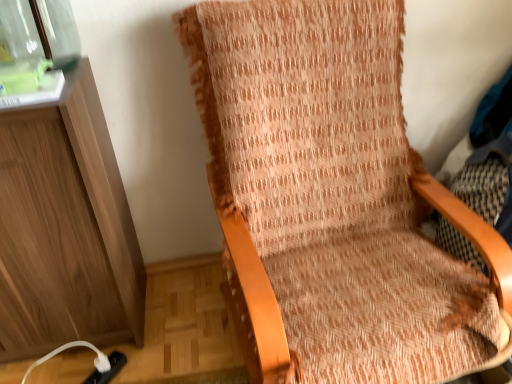
Question: Is transparent glass jar at upper left inside the boundaries of textured orange fabric chair at center, or outside?

Choices:
 (A) inside
 (B) outside

Answer: (B)

Question: From a real-world perspective, is transparent glass jar at upper left positioned above or below textured orange fabric chair at center?

Choices:
 (A) above
 (B) below

Answer: (A)

Question: From the image's perspective, is transparent glass jar at upper left located above or below textured orange fabric chair at center?

Choices:
 (A) above
 (B) below

Answer: (A)

Question: Looking at the image, does textured orange fabric chair at center seem bigger or smaller compared to transparent glass jar at upper left?

Choices:
 (A) big
 (B) small

Answer: (A)

Question: From a real-world perspective, is textured orange fabric chair at center above or below transparent glass jar at upper left?

Choices:
 (A) below
 (B) above

Answer: (A)

Question: Considering the positions of point (407, 233) and point (11, 48), is point (407, 233) closer or farther from the camera than point (11, 48)?

Choices:
 (A) closer
 (B) farther

Answer: (B)

Question: In terms of width, does textured orange fabric chair at center look wider or thinner when compared to transparent glass jar at upper left?

Choices:
 (A) wide
 (B) thin

Answer: (A)